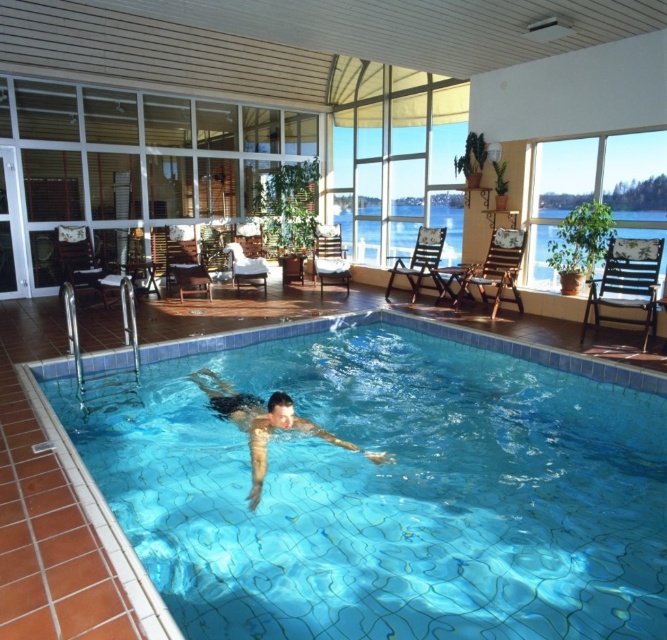
You are standing at the edge of the pool and want to reach a floating ball located at point [658,381]. If your maximum reach is 12 feet, can you reach it without moving?

The distance of point [658,381] from camera is 15.27 feet, so you cannot reach it without moving since it is beyond your 12 feet reach.

You are a lifeguard on duty and need to ensure safety. Given the blue tile swimming pool at center and the skinny man at center, which one is bigger in size?

The blue tile swimming pool at center is larger in size than the skinny man at center, so the pool is bigger.